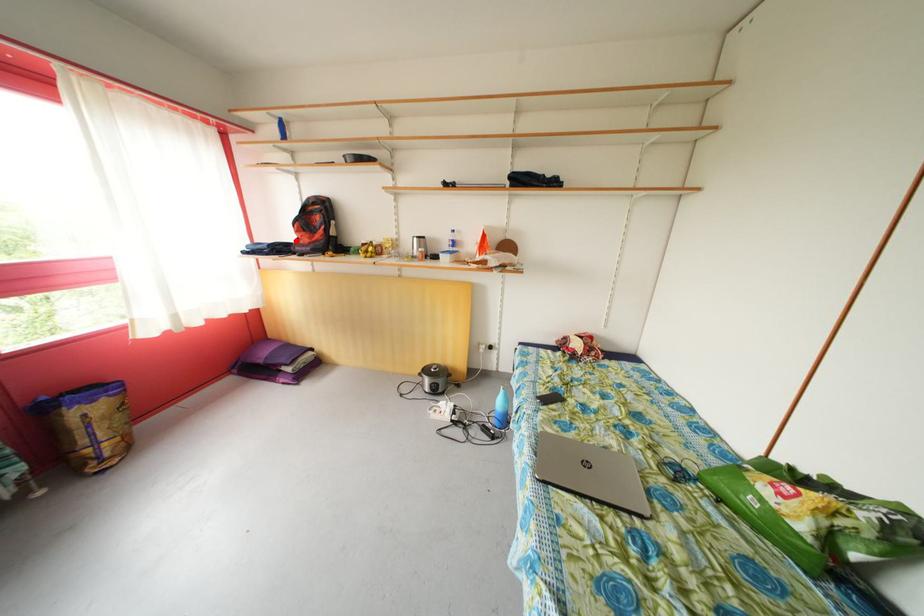
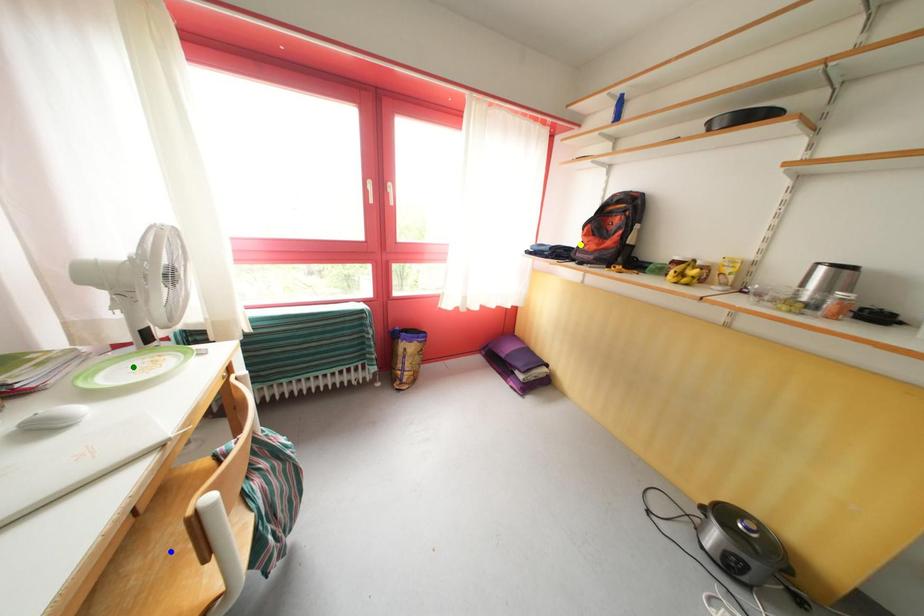
Question: I am providing you with two images of the same scene from different viewpoints. A red point is marked on the first image. You are given multiple points on the second image. In image 2, which mark is for the same physical point as the one in image 1?

Choices:
 (A) blue point
 (B) yellow point
 (C) green point

Answer: (B)